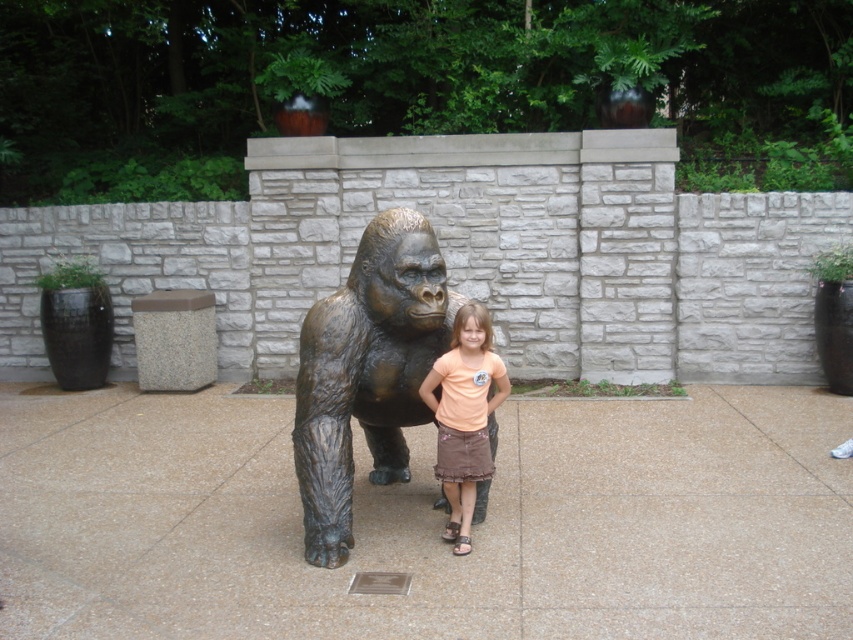
Which is behind, point (299, 380) or point (451, 344)?

Point (451, 344)

Does bronze textured gorilla at center appear on the right side of matte peach t-shirt at center?

Incorrect, bronze textured gorilla at center is not on the right side of matte peach t-shirt at center.

Where is `bronze textured gorilla at center`? bronze textured gorilla at center is located at coordinates (366, 372).

In order to click on bronze textured gorilla at center in this screenshot , I will do `click(366, 372)`.